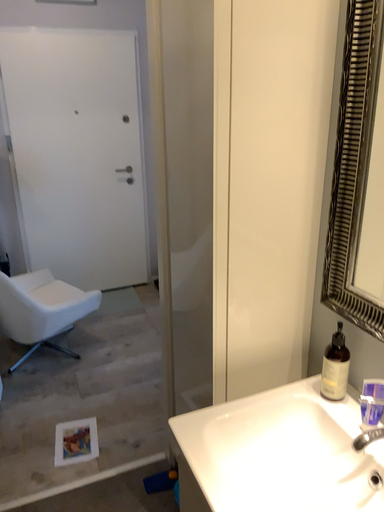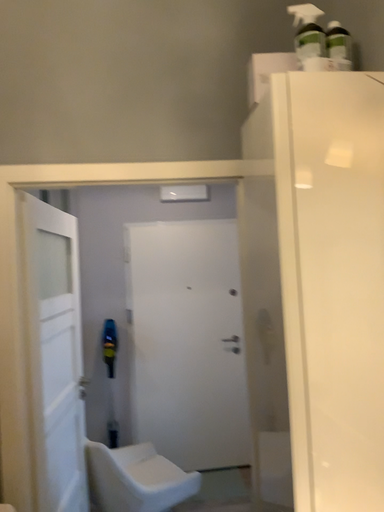
Question: How did the camera likely rotate when shooting the video?

Choices:
 (A) rotated right
 (B) rotated left

Answer: (B)